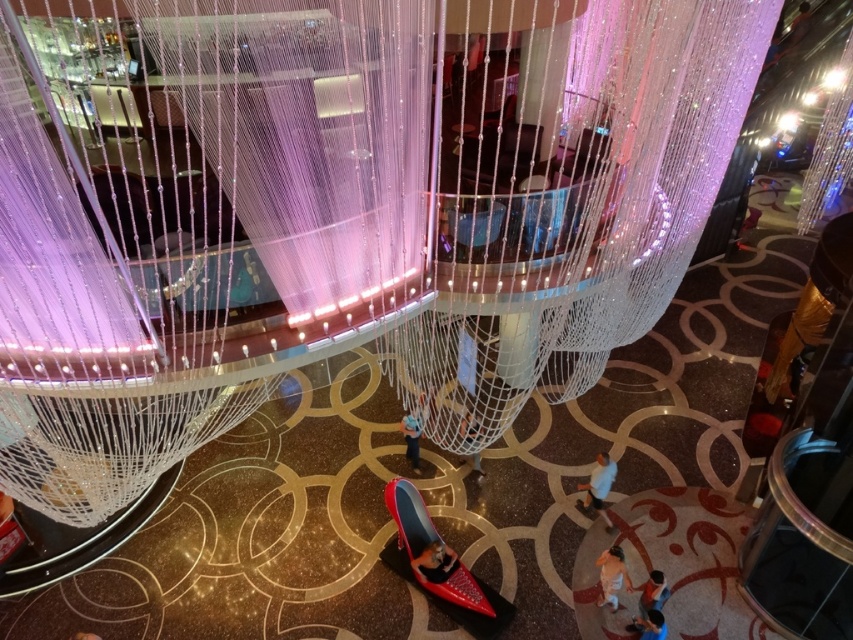
At what (x,y) coordinates should I click in order to perform the action: click on blue matte shirt at lower right. Please return your answer as a coordinate pair (x, y). This screenshot has width=853, height=640. Looking at the image, I should click on (599, 486).

This screenshot has width=853, height=640. What do you see at coordinates (599, 486) in the screenshot? I see `blue matte shirt at lower right` at bounding box center [599, 486].

Where is `blue matte shirt at lower right`? blue matte shirt at lower right is located at coordinates (599, 486).

Is point (407, 445) in front of point (465, 433)?

Yes, it is.

Does point (424, 404) lie in front of point (463, 435)?

That is False.

Locate an element on the screen. blue denim jeans at center is located at coordinates (415, 429).

Does orange fabric person at lower right have a larger size compared to blue denim jeans at center?

Actually, orange fabric person at lower right might be smaller than blue denim jeans at center.

Between orange fabric person at lower right and blue denim jeans at center, which one appears on the right side from the viewer's perspective?

Positioned to the right is orange fabric person at lower right.

What do you see at coordinates (612, 576) in the screenshot? I see `orange fabric person at lower right` at bounding box center [612, 576].

You are a GUI agent. You are given a task and a screenshot of the screen. Output one action in this format:
    pyautogui.click(x=<x>, y=<y>)
    Task: Click on the orange fabric person at lower right
    The image size is (853, 640).
    Given the screenshot: What is the action you would take?
    pyautogui.click(x=612, y=576)